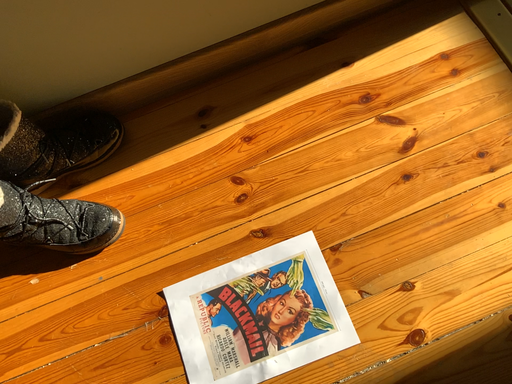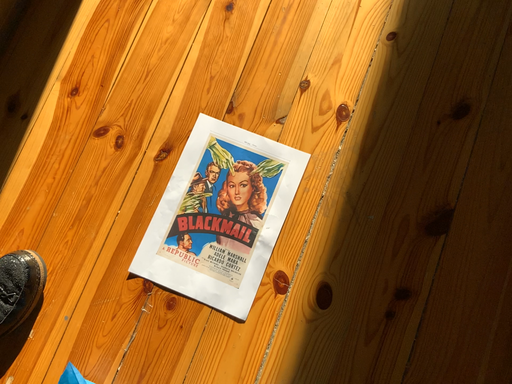
Question: Which way did the camera rotate in the video?

Choices:
 (A) rotated left
 (B) rotated right

Answer: (B)